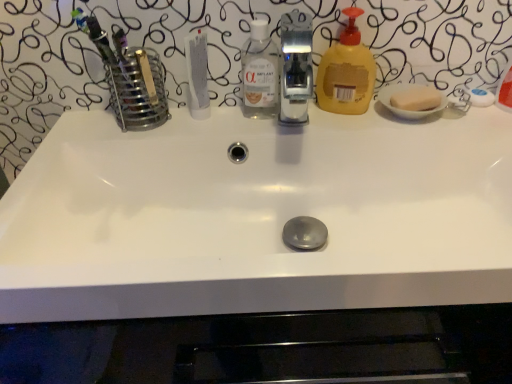
The image size is (512, 384). Identify the location of free point to the right of satin nickel faucet at center. (374, 120).